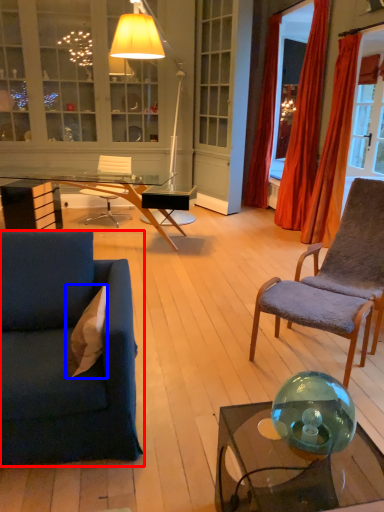
Question: Among these objects, which one is nearest to the camera, studio couch (highlighted by a red box) or pillow (highlighted by a blue box)?

Choices:
 (A) studio couch
 (B) pillow

Answer: (A)